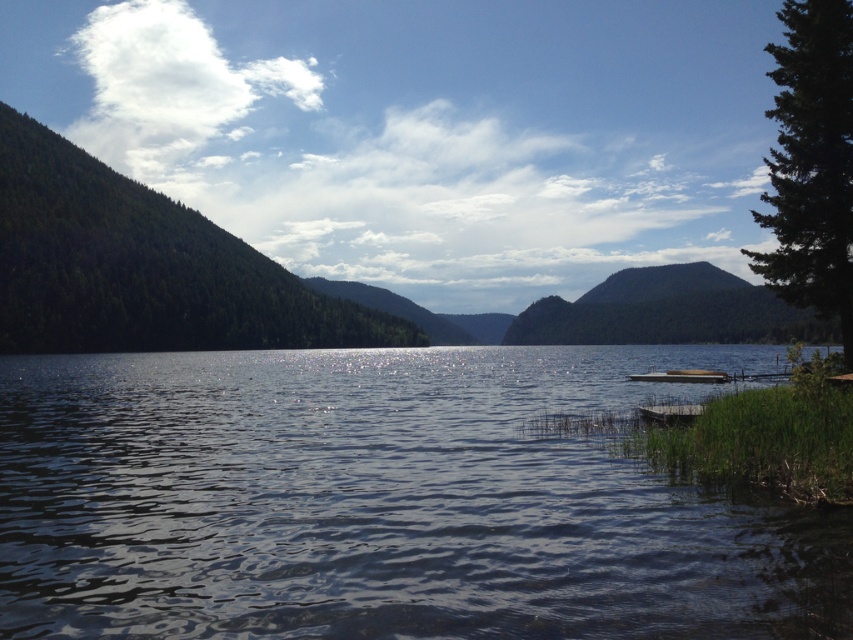
Is glistening water at center to the left of wooden dock at lower right from the viewer's perspective?

Yes, glistening water at center is to the left of wooden dock at lower right.

Does glistening water at center appear under wooden dock at lower right?

Indeed, glistening water at center is positioned under wooden dock at lower right.

You are a GUI agent. You are given a task and a screenshot of the screen. Output one action in this format:
    pyautogui.click(x=<x>, y=<y>)
    Task: Click on the glistening water at center
    Image resolution: width=853 pixels, height=640 pixels.
    Given the screenshot: What is the action you would take?
    pyautogui.click(x=383, y=500)

Does green textured forest at left have a greater width compared to green textured pine tree at right?

Yes.

Is point (68, 188) behind point (840, 244)?

Yes.

Image resolution: width=853 pixels, height=640 pixels. Find the location of `green textured forest at left`. green textured forest at left is located at coordinates (143, 266).

Is the position of green textured pine tree at right more distant than that of wooden dock at lower right?

No.

Who is shorter, green textured pine tree at right or wooden dock at lower right?

wooden dock at lower right

In order to click on green textured pine tree at right in this screenshot , I will do 811,164.